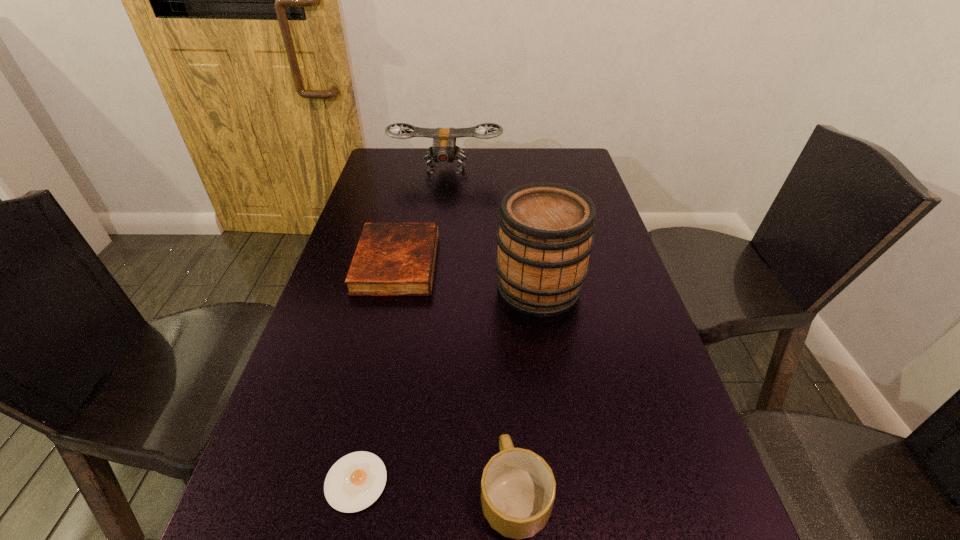
Where is `vacant region that satisfies the following two spatial constraints: 1. on the back side of the tallest object; 2. on the left side of the shortest object`? vacant region that satisfies the following two spatial constraints: 1. on the back side of the tallest object; 2. on the left side of the shortest object is located at coordinates (397, 288).

Locate an element on the screen. free space that satisfies the following two spatial constraints: 1. on the spine side of the egg yolk; 2. on the left side of the second shortest object is located at coordinates point(348,482).

At what (x,y) coordinates should I click in order to perform the action: click on vacant point that satisfies the following two spatial constraints: 1. on the spine side of the Bible; 2. on the right side of the tallest object. Please return your answer as a coordinate pair (x, y). The height and width of the screenshot is (540, 960). Looking at the image, I should click on (391, 288).